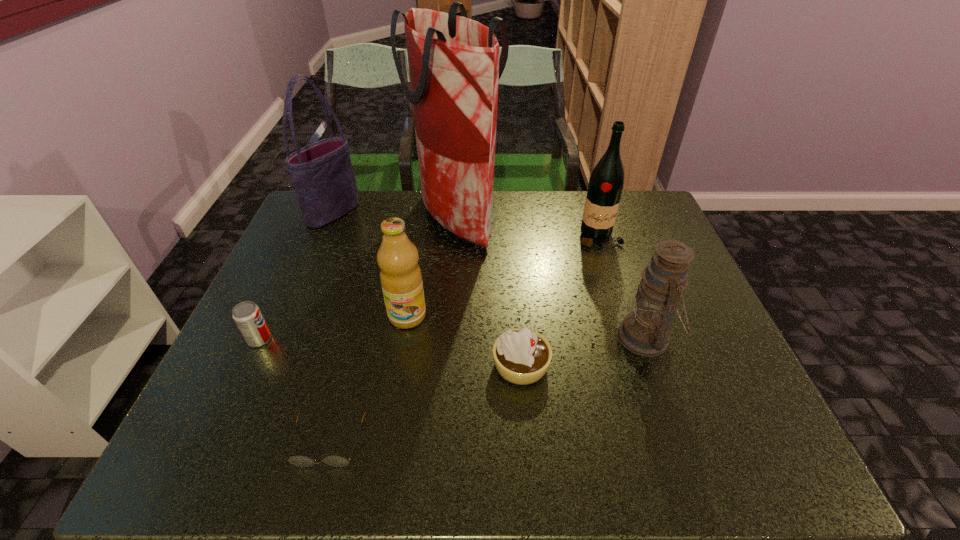
Find the location of a particular element. tote bag that is positioned at the left edge is located at coordinates (322, 174).

Where is `soda that is at the left edge`? This screenshot has width=960, height=540. soda that is at the left edge is located at coordinates (247, 315).

The image size is (960, 540). What are the coordinates of `wine bottle situated at the right edge` in the screenshot? It's located at (605, 187).

Where is `oil lamp present at the right edge`? oil lamp present at the right edge is located at coordinates (645, 331).

You are a GUI agent. You are given a task and a screenshot of the screen. Output one action in this format:
    pyautogui.click(x=<x>, y=<y>)
    Task: Click on the object that is at the far left corner
    
    Given the screenshot: What is the action you would take?
    pyautogui.click(x=322, y=174)

Locate an element on the screen. This screenshot has height=540, width=960. object that is at the far right corner is located at coordinates (605, 187).

In the image, there is a desktop. Where is `free region at the far edge`? The image size is (960, 540). free region at the far edge is located at coordinates (512, 215).

In the image, there is a desktop. Where is `vacant region at the near edge`? The width and height of the screenshot is (960, 540). vacant region at the near edge is located at coordinates (313, 450).

Where is `free region at the left edge`? free region at the left edge is located at coordinates (240, 345).

Find the location of a particular element. Image resolution: width=960 pixels, height=540 pixels. vacant space at the right edge of the desktop is located at coordinates (636, 250).